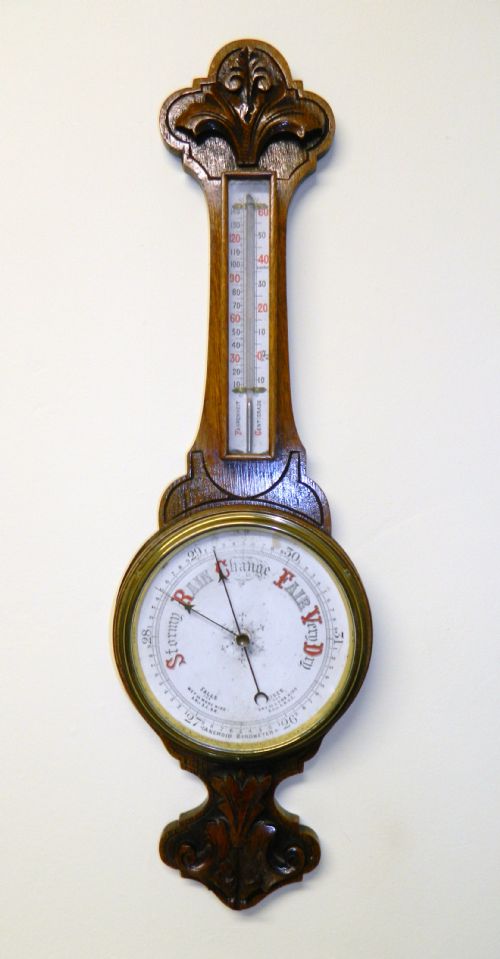
Find the location of a particular element. The width and height of the screenshot is (500, 959). thermometer is located at coordinates (250, 424), (253, 201), (230, 186), (265, 186), (233, 440), (262, 445).